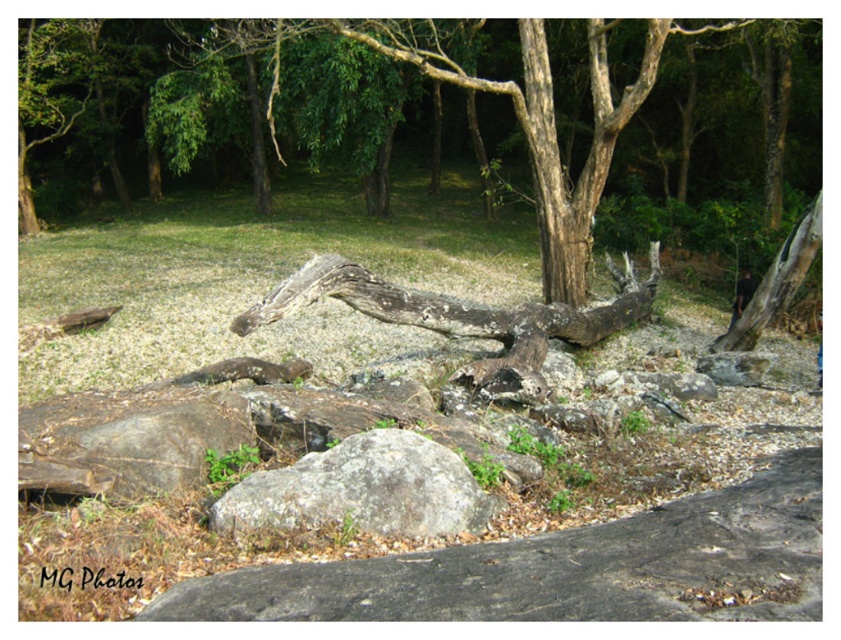
You are a hiker carrying a 3 meter long backpack. You need to cross the forest clearing. There are two obstacles in your path, the gray rough rock at center and the weathered wood log at center. Can you pass between them without needing to move either obstacle?

The gray rough rock at center and weathered wood log at center are 3.14 meters apart from each other. Since your backpack is 3 meters long, you can pass between them as the distance is sufficient.

You are a hiker who wants to cross over the weathered wood log at center. There is a gray rough rock at center nearby. Which object is closer to you as you approach the log?

The gray rough rock at center is in front of the weathered wood log at center, so the gray rough rock at center is closer to you as you approach the log.

You are standing in the forest clearing and want to place a small potted plant exactly at the point marked by the coordinates point (362, 490). What object will the plant be placed on?

The point (362, 490) indicates a gray rough rock at center, so the plant will be placed on the gray rough rock at center.